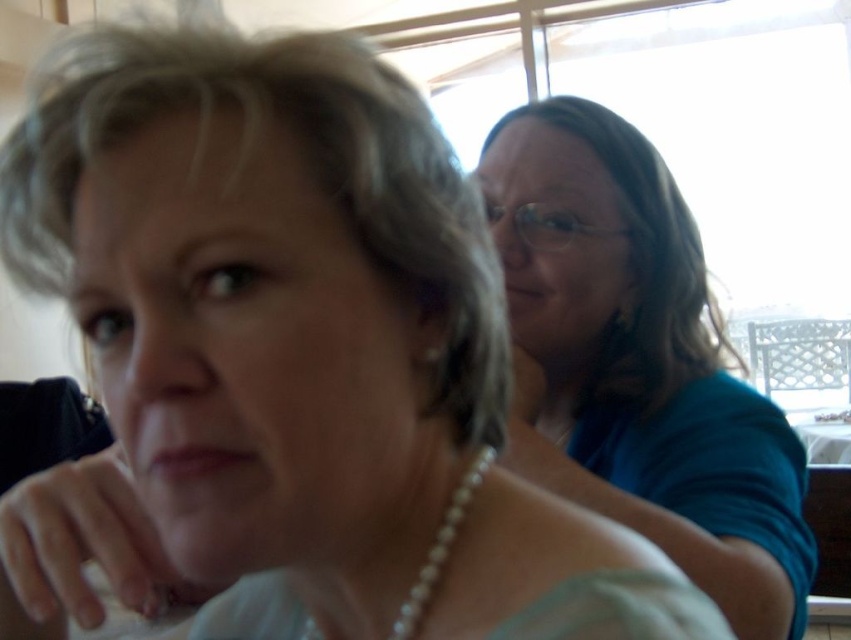
Does blue fabric shirt at upper right have a greater height compared to matte pearl necklace at lower center?

Correct, blue fabric shirt at upper right is much taller as matte pearl necklace at lower center.

Is the position of blue fabric shirt at upper right more distant than that of matte pearl necklace at lower center?

Yes, blue fabric shirt at upper right is further from the viewer.

Between point (663, 241) and point (178, 458), which one is positioned in front?

Positioned in front is point (178, 458).

Find the location of a particular element. The height and width of the screenshot is (640, 851). blue fabric shirt at upper right is located at coordinates (637, 364).

Can you confirm if pearl necklace at center is smaller than matte pearl necklace at lower center?

No.

Locate an element on the screen. This screenshot has width=851, height=640. pearl necklace at center is located at coordinates (440, 547).

I want to click on pearl necklace at center, so click(x=440, y=547).

Can you confirm if blue fabric shirt at upper right is positioned to the left of pearl necklace at center?

Incorrect, blue fabric shirt at upper right is not on the left side of pearl necklace at center.

Between point (684, 285) and point (477, 488), which one is positioned behind?

The point (684, 285) is more distant.

Identify the location of blue fabric shirt at upper right. This screenshot has height=640, width=851. (637, 364).